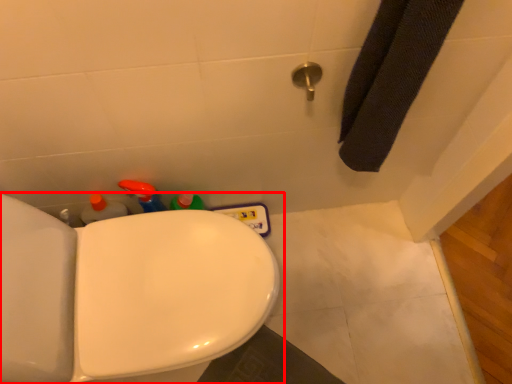
Question: From the image's perspective, considering the relative positions of toilet (annotated by the red box) and shower in the image provided, where is toilet (annotated by the red box) located with respect to the staircase?

Choices:
 (A) above
 (B) below

Answer: (B)